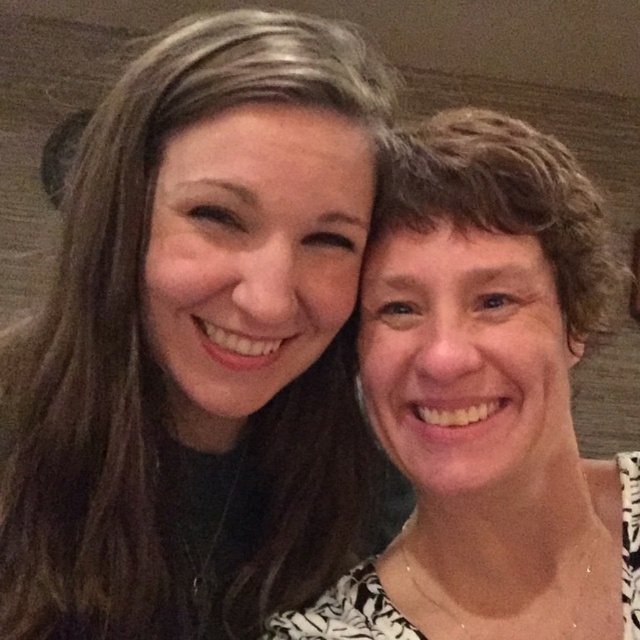
You are a photographer trying to adjust the lighting for a portrait. You notice the smooth brown hair at upper left and the matte black hair at right. Which hair should you focus your lighting on to ensure it stands out more, considering their sizes?

The smooth brown hair at upper left has a larger size compared to the matte black hair at right, so focusing the lighting on the smooth brown hair at upper left would make it stand out more due to its larger size.

In the scene shown: You are a photographer trying to adjust the lighting for a portrait. You notice the smooth brown hair at upper left and the matte black hair at right. Which hair is positioned closer to the camera?

The smooth brown hair at upper left is closer to the camera because the matte black hair at right is positioned behind it.